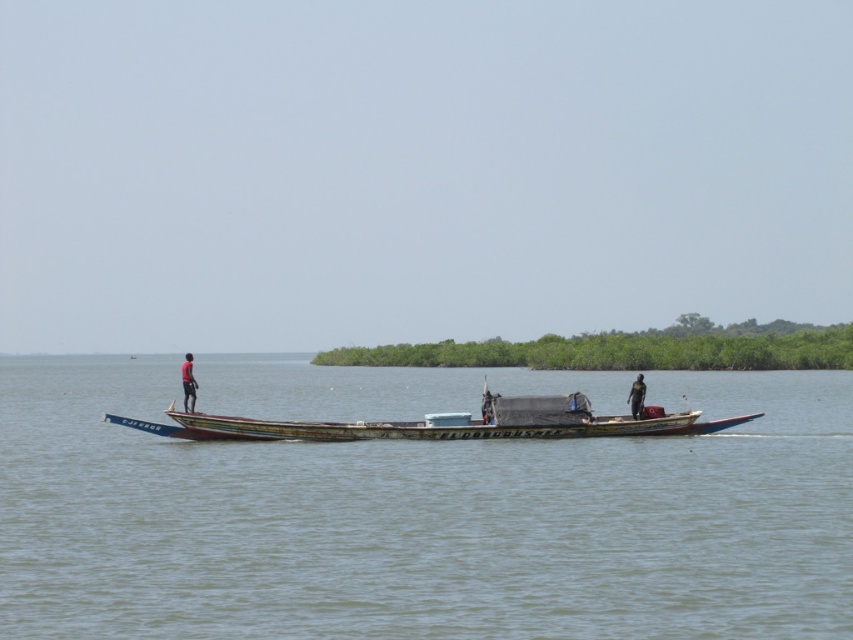
From the picture: Between greenish water at center and dark skin human at center, which one has less height?

dark skin human at center is shorter.

Which of these two, greenish water at center or dark skin human at center, stands taller?

With more height is greenish water at center.

Measure the distance between greenish water at center and camera.

46.92 feet

Find the location of `greenish water at center`. greenish water at center is located at coordinates (421, 520).